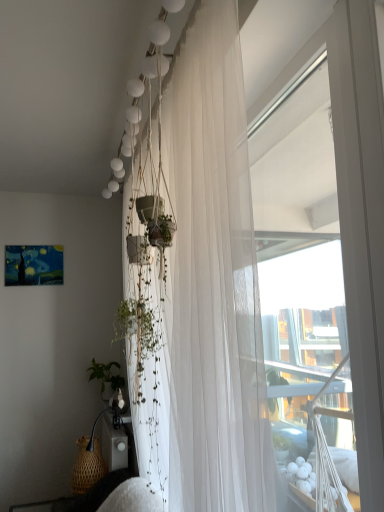
Question: Does woven brown basket at lower left have a smaller size compared to white sheer curtain at upper center?

Choices:
 (A) no
 (B) yes

Answer: (B)

Question: From the image's perspective, is woven brown basket at lower left over white sheer curtain at upper center?

Choices:
 (A) no
 (B) yes

Answer: (A)

Question: Is white sheer curtain at upper center at the back of woven brown basket at lower left?

Choices:
 (A) yes
 (B) no

Answer: (B)

Question: From a real-world perspective, is woven brown basket at lower left located higher than white sheer curtain at upper center?

Choices:
 (A) yes
 (B) no

Answer: (B)

Question: Considering the relative sizes of woven brown basket at lower left and white sheer curtain at upper center in the image provided, is woven brown basket at lower left bigger than white sheer curtain at upper center?

Choices:
 (A) yes
 (B) no

Answer: (B)

Question: From the image's perspective, is woven brown basket at lower left under white sheer curtain at upper center?

Choices:
 (A) no
 (B) yes

Answer: (B)

Question: Is white sheer curtain at upper center not close to woven brown basket at lower left?

Choices:
 (A) no
 (B) yes

Answer: (B)

Question: Is white sheer curtain at upper center positioned with its back to woven brown basket at lower left?

Choices:
 (A) no
 (B) yes

Answer: (A)

Question: Is white sheer curtain at upper center shorter than woven brown basket at lower left?

Choices:
 (A) no
 (B) yes

Answer: (A)

Question: Is white sheer curtain at upper center bigger than woven brown basket at lower left?

Choices:
 (A) no
 (B) yes

Answer: (B)

Question: Does white sheer curtain at upper center contain woven brown basket at lower left?

Choices:
 (A) yes
 (B) no

Answer: (B)

Question: Is white sheer curtain at upper center facing towards woven brown basket at lower left?

Choices:
 (A) no
 (B) yes

Answer: (A)

Question: In the image, is white sheer curtain at upper center on the left side or the right side of woven brown basket at lower left?

Choices:
 (A) right
 (B) left

Answer: (A)